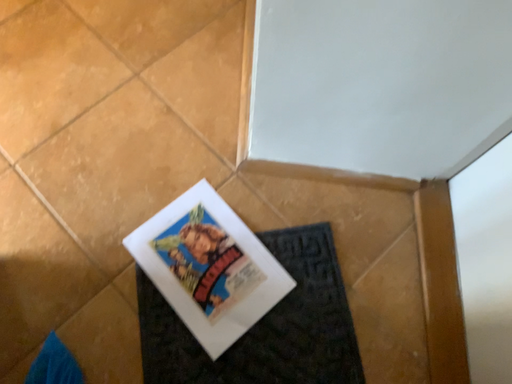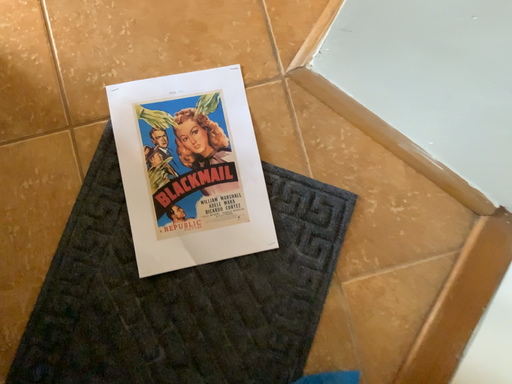
Question: Which way did the camera rotate in the video?

Choices:
 (A) rotated right
 (B) rotated left

Answer: (B)